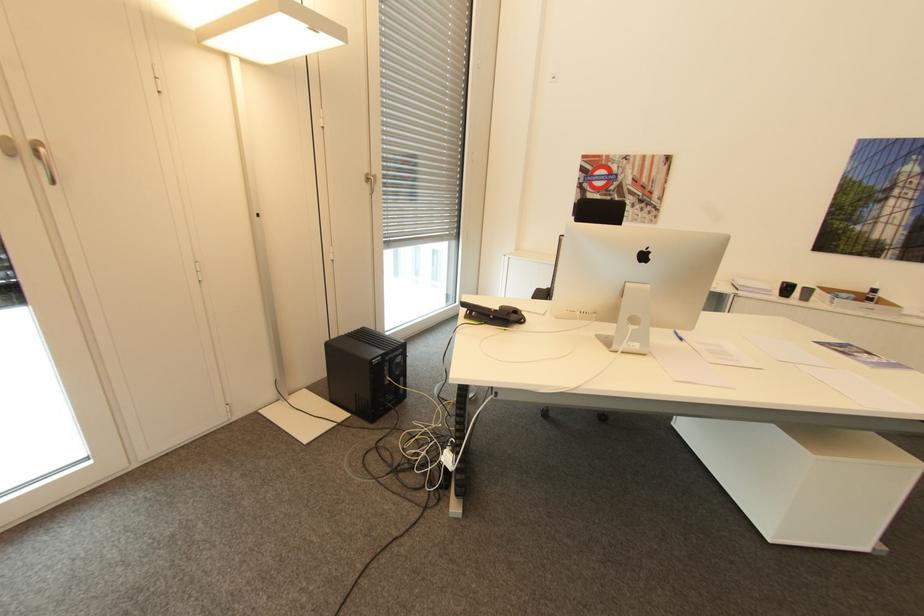
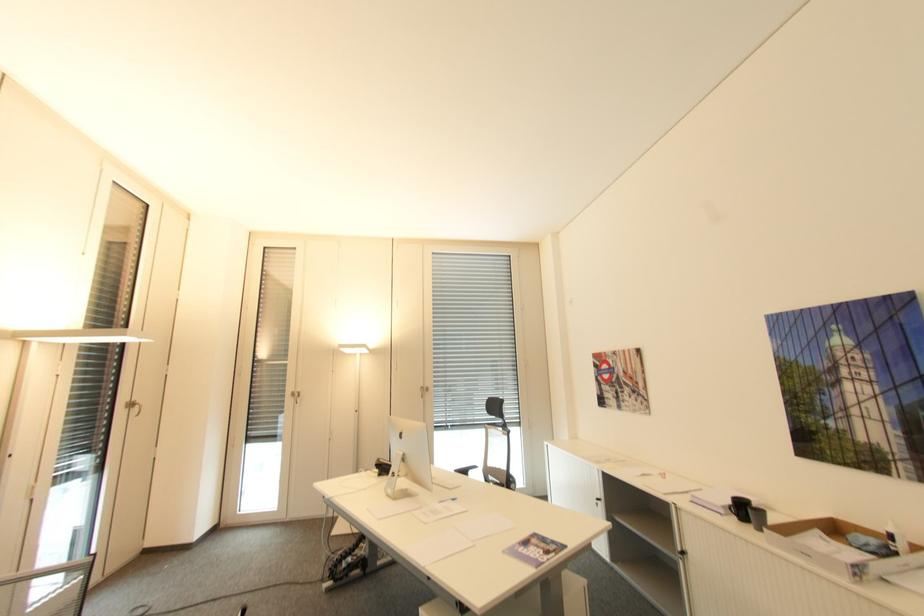
Where in the second image is the point corresponding to point 372,175 from the first image?

(427, 387)